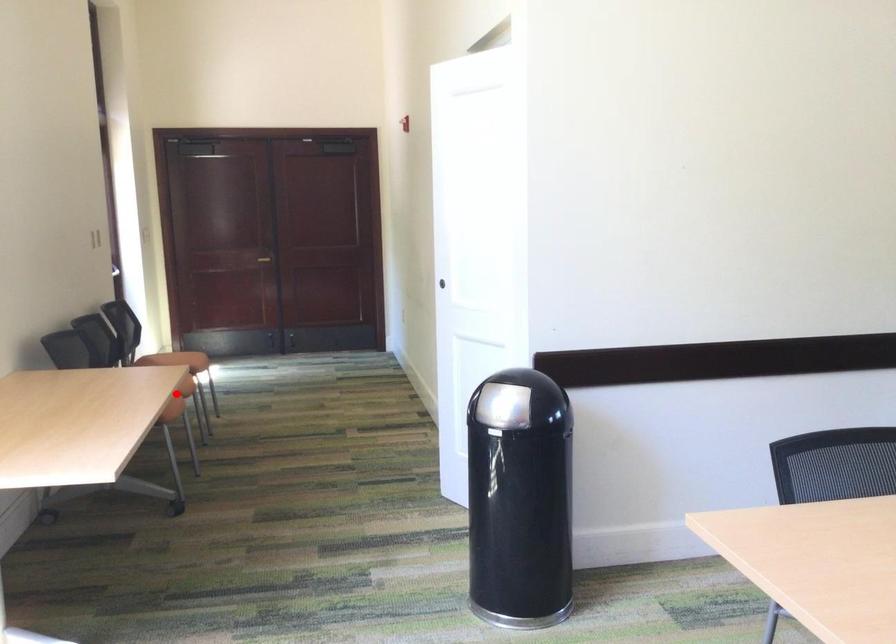
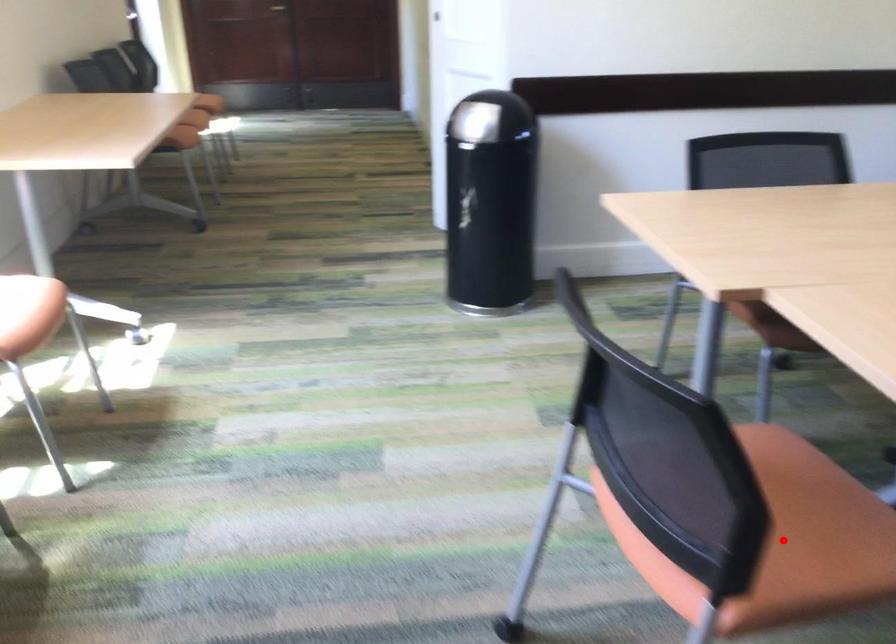
I am providing you with two images of the same scene from different viewpoints. A red point is marked on the first image and another point is marked on the second image. Do the highlighted points in image1 and image2 indicate the same real-world spot?

No